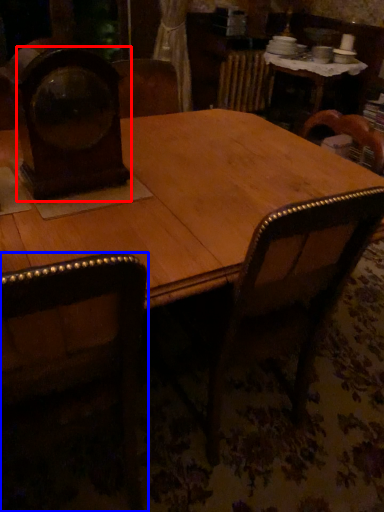
Question: Which object is closer to the camera taking this photo, clock (highlighted by a red box) or chair (highlighted by a blue box)?

Choices:
 (A) clock
 (B) chair

Answer: (B)